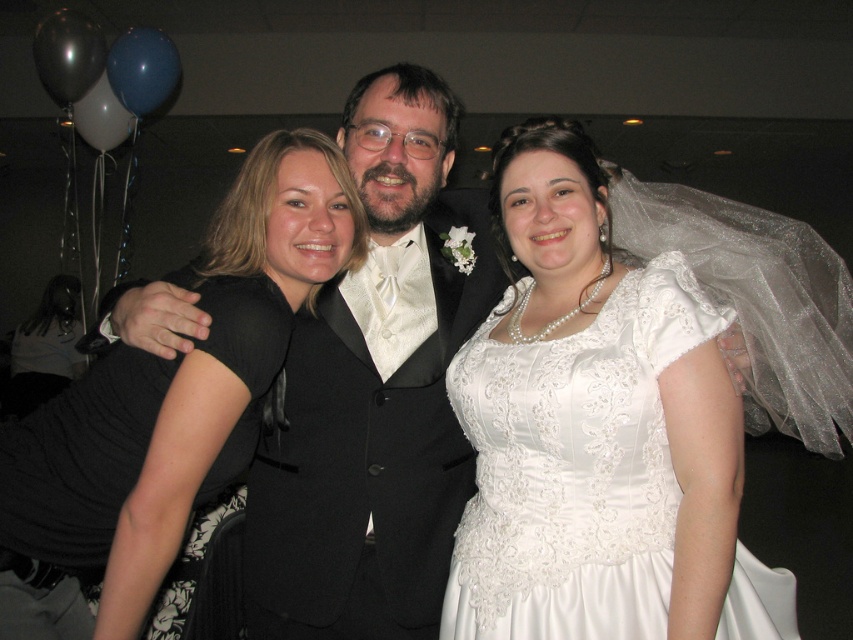
Is matte black suit at center further to camera compared to black satin dress at center?

Yes, matte black suit at center is further from the viewer.

Who is positioned more to the left, matte black suit at center or black satin dress at center?

Positioned to the left is black satin dress at center.

The image size is (853, 640). In order to click on matte black suit at center in this screenshot , I will do `click(376, 392)`.

Where is `matte black suit at center`? This screenshot has width=853, height=640. matte black suit at center is located at coordinates (376, 392).

This screenshot has height=640, width=853. Describe the element at coordinates (596, 432) in the screenshot. I see `white satin dress at center` at that location.

Which is more to the right, white satin dress at center or matte black suit at center?

From the viewer's perspective, white satin dress at center appears more on the right side.

Locate an element on the screen. The image size is (853, 640). white satin dress at center is located at coordinates (596, 432).

The height and width of the screenshot is (640, 853). I want to click on white satin dress at center, so click(x=596, y=432).

Between white satin dress at center and black satin dress at center, which one is positioned lower?

white satin dress at center is lower down.

What do you see at coordinates (596, 432) in the screenshot?
I see `white satin dress at center` at bounding box center [596, 432].

Find the location of `white satin dress at center`. white satin dress at center is located at coordinates (596, 432).